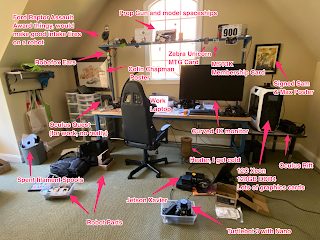
You are a GUI agent. You are given a task and a screenshot of the screen. Output one action in this format:
    pyautogui.click(x=<x>, y=<y>)
    Task: Click on the top of computer hard drive
    
    Given the screenshot: What is the action you would take?
    pyautogui.click(x=266, y=87)